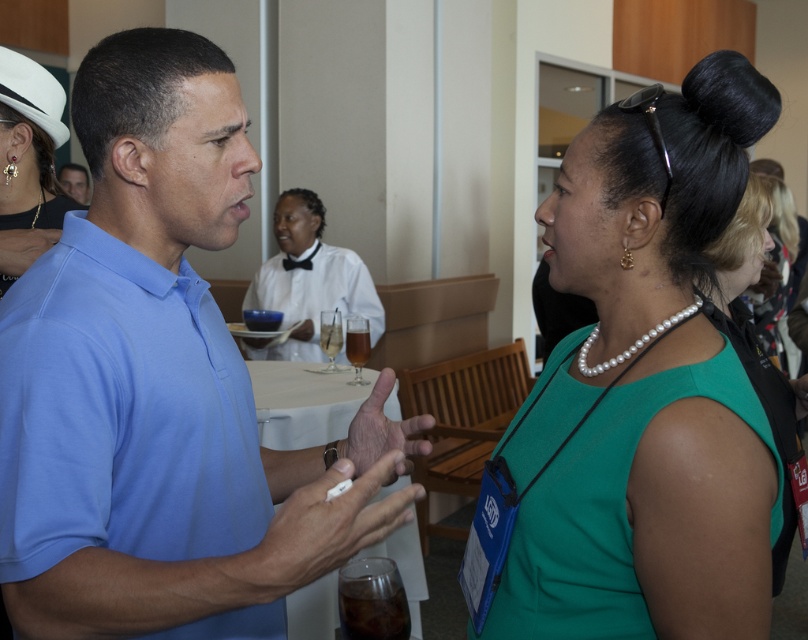
Question: Is matte blue polo shirt at left positioned behind white satin dress at center?

Choices:
 (A) no
 (B) yes

Answer: (A)

Question: Which object is positioned closest to the matte blue polo shirt at left?

Choices:
 (A) green fabric dress at center
 (B) blue smooth shirt at left

Answer: (B)

Question: Which point appears farthest from the camera in this image?

Choices:
 (A) (372, 320)
 (B) (607, 371)
 (C) (9, 257)
 (D) (82, 202)

Answer: (D)

Question: Does blue smooth shirt at left have a lesser width compared to matte blue polo shirt at left?

Choices:
 (A) yes
 (B) no

Answer: (B)

Question: Does pearl earrings at upper left have a smaller size compared to white satin dress at center?

Choices:
 (A) yes
 (B) no

Answer: (A)

Question: Among these points, which one is farthest from the camera?

Choices:
 (A) 15,150
 (B) 133,445

Answer: (A)